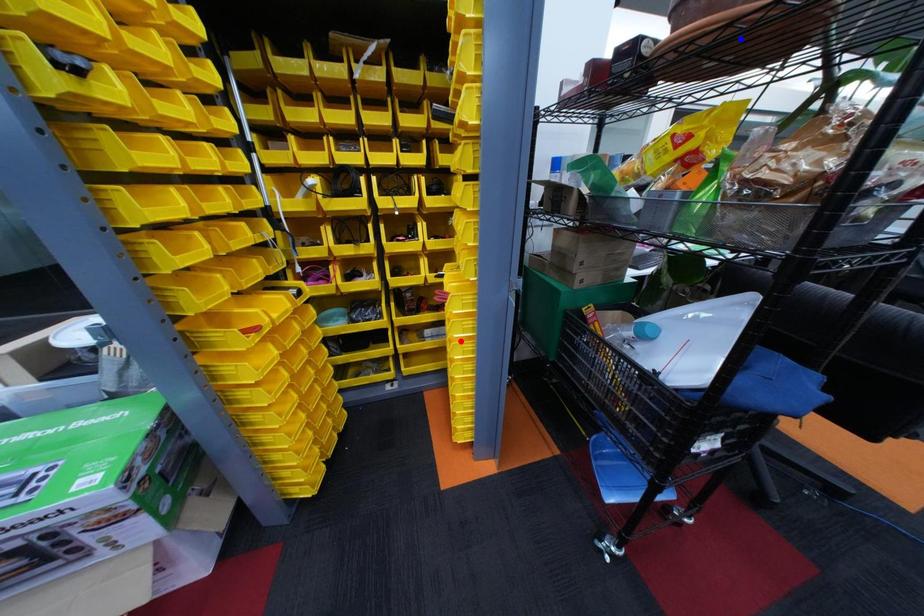
Question: Two points are marked on the image. Which point is closer to the camera?

Choices:
 (A) Blue point is closer.
 (B) Red point is closer.

Answer: (A)